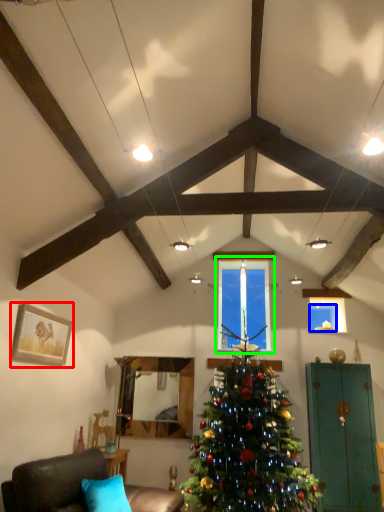
Question: Which object is the farthest from picture frame (highlighted by a red box)? Choose among these: window screen (highlighted by a blue box) or window (highlighted by a green box).

Choices:
 (A) window screen
 (B) window

Answer: (A)